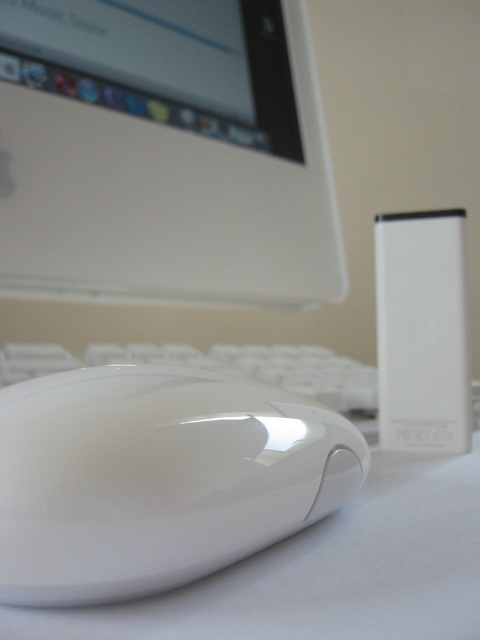
Does white glossy computer monitor at upper left have a larger size compared to white matte keyboard at center?

Correct, white glossy computer monitor at upper left is larger in size than white matte keyboard at center.

Can you confirm if white glossy computer monitor at upper left is positioned below white matte keyboard at center?

No.

Is point (12, 116) positioned in front of point (315, 394)?

Yes.

This screenshot has height=640, width=480. I want to click on white glossy computer monitor at upper left, so click(165, 152).

Can you confirm if white glossy mouse at center is positioned above white matte keyboard at center?

Yes.

Can you confirm if white glossy mouse at center is bigger than white matte keyboard at center?

No, white glossy mouse at center is not bigger than white matte keyboard at center.

Identify the location of white glossy mouse at center. (156, 477).

Where is `white glossy mouse at center`? The width and height of the screenshot is (480, 640). white glossy mouse at center is located at coordinates (156, 477).

Is white glossy computer monitor at upper left shorter than white glossy mouse at center?

In fact, white glossy computer monitor at upper left may be taller than white glossy mouse at center.

Does white glossy computer monitor at upper left have a greater height compared to white glossy mouse at center?

Yes, white glossy computer monitor at upper left is taller than white glossy mouse at center.

Locate an element on the screen. The width and height of the screenshot is (480, 640). white glossy computer monitor at upper left is located at coordinates (165, 152).

Find the location of `white glossy computer monitor at upper left`. white glossy computer monitor at upper left is located at coordinates (165, 152).